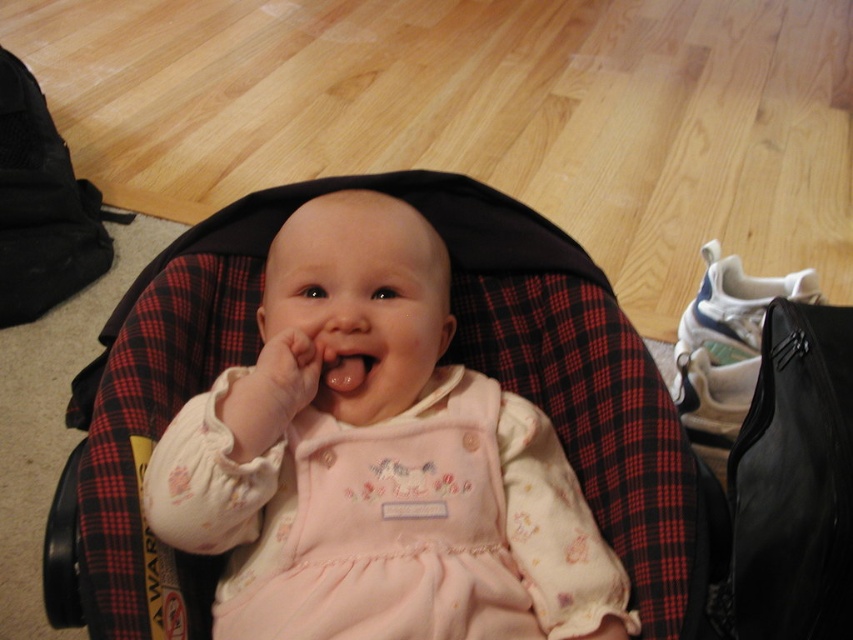
You are taking a photo of the baby in the car seat. You notice two points in the image at coordinates point (589, 611) and point (361, 365). Which point is closer to the camera?

Point (589, 611) is closer to the camera than point (361, 365).

You are a parent trying to place a 12 inch long stuffed animal between the point at coordinates (288,365) and the baby in the black car seat. Can the stuffed animal fit in the space between them?

The distance between the point at coordinates (288,365) and the baby in the black car seat is 33.27 inches. Since the stuffed animal is only 12 inches long, there is enough space to place it between them.